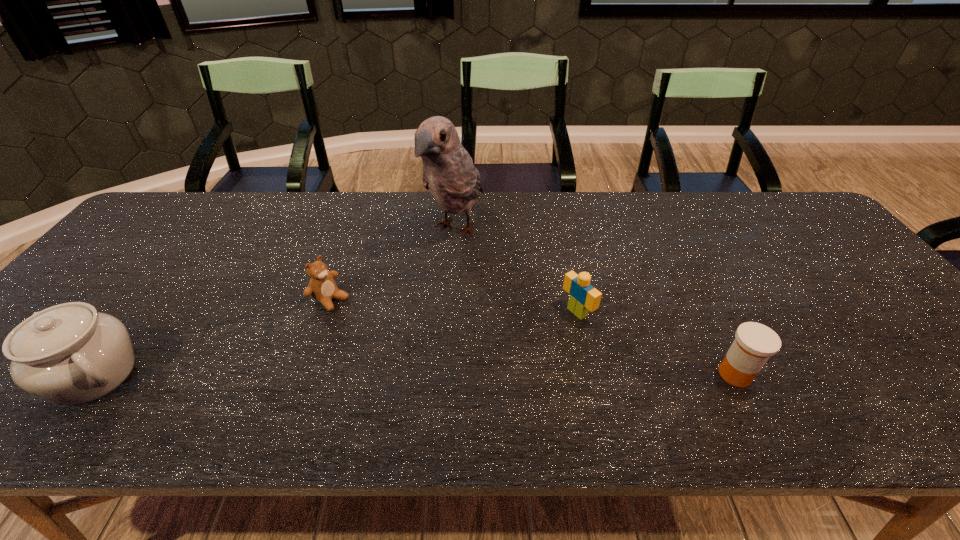
Find the location of a particular element. The height and width of the screenshot is (540, 960). vacant space that's between the third object from left to right and the fourth shortest object is located at coordinates (x=276, y=302).

At what (x,y) coordinates should I click in order to perform the action: click on unoccupied position between the parrot and the leftmost object. Please return your answer as a coordinate pair (x, y). This screenshot has width=960, height=540. Looking at the image, I should click on (276, 302).

You are a GUI agent. You are given a task and a screenshot of the screen. Output one action in this format:
    pyautogui.click(x=<x>, y=<y>)
    Task: Click on the free space between the parrot and the chinaware
    This screenshot has width=960, height=540.
    Given the screenshot: What is the action you would take?
    pyautogui.click(x=276, y=302)

What are the coordinates of `empty space between the Lego and the farthest object` in the screenshot? It's located at (516, 271).

Where is `free space between the rightmost object and the Lego`? This screenshot has width=960, height=540. free space between the rightmost object and the Lego is located at coordinates (656, 343).

The width and height of the screenshot is (960, 540). What are the coordinates of `free space between the chinaware and the second object from left to right` in the screenshot? It's located at (213, 337).

Where is `vacant area between the rightmost object and the second tallest object`? vacant area between the rightmost object and the second tallest object is located at coordinates (416, 375).

Identify the location of the fourth closest object to the third object from left to right. (70, 354).

Image resolution: width=960 pixels, height=540 pixels. Identify the location of object that stands as the closest to the Lego. (449, 174).

You are a GUI agent. You are given a task and a screenshot of the screen. Output one action in this format:
    pyautogui.click(x=<x>, y=<y>)
    Task: Click on the free space that satisfies the following two spatial constraints: 1. on the front side of the Lego; 2. on the left side of the teddy bear
    The width and height of the screenshot is (960, 540).
    Given the screenshot: What is the action you would take?
    pyautogui.click(x=326, y=312)